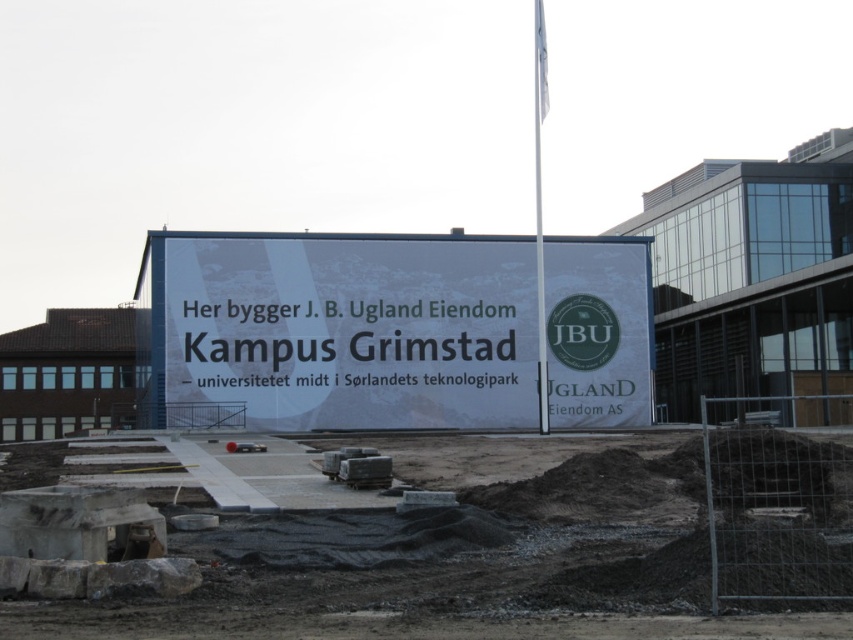
Is point (439, 442) more distant than point (332, 396)?

No, (439, 442) is closer to viewer.

Is point (84, 604) more distant than point (366, 257)?

No, (84, 604) is closer to viewer.

The height and width of the screenshot is (640, 853). In order to click on concrete paving at center in this screenshot , I will do `click(450, 552)`.